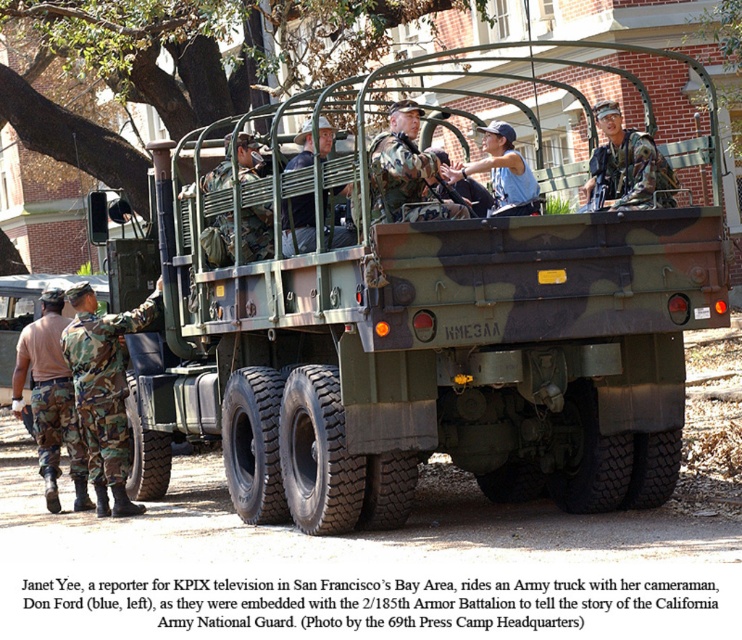
Question: Which point appears closest to the camera in this image?

Choices:
 (A) (626, 168)
 (B) (45, 493)
 (C) (246, 268)
 (D) (85, 387)

Answer: (A)

Question: Which point appears farthest from the camera in this image?

Choices:
 (A) (42, 337)
 (B) (308, 200)
 (C) (354, 120)

Answer: (C)

Question: Is camo fabric truck at center positioned behind blue cotton shirt at center?

Choices:
 (A) no
 (B) yes

Answer: (A)

Question: Estimate the real-world distances between objects in this image. Which object is closer to the camouflage uniform at left?

Choices:
 (A) camouflage fabric helmet at center
 (B) camouflage fabric soldier at left
 (C) camo fabric truck at center
 (D) camouflage uniform at center

Answer: (B)

Question: Can you confirm if camouflage uniform at left is bigger than blue cotton shirt at center?

Choices:
 (A) yes
 (B) no

Answer: (A)

Question: Can you confirm if camo fabric truck at center is positioned to the right of camo uniform at center?

Choices:
 (A) yes
 (B) no

Answer: (B)